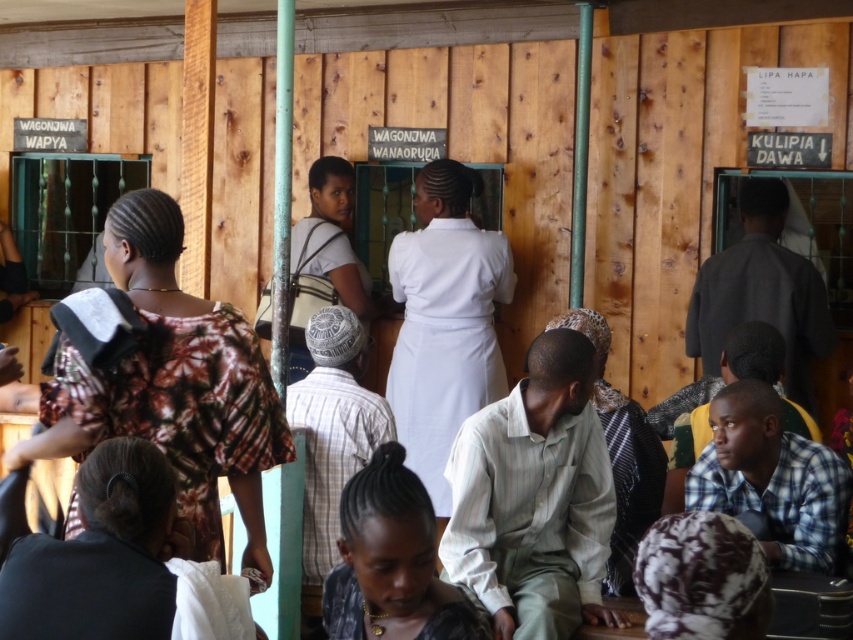
Question: Estimate the real-world distances between objects in this image. Which object is closer to the white smooth uniform at center?

Choices:
 (A) light brown fabric headscarf at lower center
 (B) printed fabric dress at left

Answer: (A)

Question: Is printed fabric dress at left to the left of black textured hair at center from the viewer's perspective?

Choices:
 (A) no
 (B) yes

Answer: (B)

Question: Which point is farther to the camera?

Choices:
 (A) (115, 420)
 (B) (355, 550)
 (C) (422, 413)

Answer: (C)

Question: Can you confirm if printed fabric dress at left is bigger than light brown fabric headscarf at lower center?

Choices:
 (A) yes
 (B) no

Answer: (A)

Question: Does printed fabric dress at left appear on the right side of light brown fabric headscarf at lower center?

Choices:
 (A) no
 (B) yes

Answer: (A)

Question: Which object appears farthest from the camera in this image?

Choices:
 (A) printed fabric dress at left
 (B) white smooth uniform at center

Answer: (B)